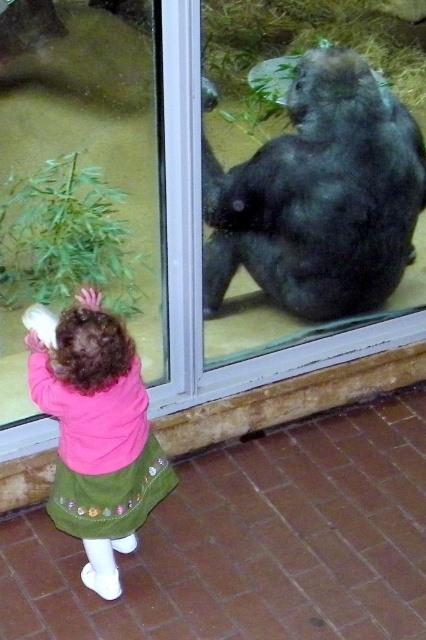
Question: Can you confirm if dark gray fur at center is positioned above pink fleece jacket at lower left?

Choices:
 (A) no
 (B) yes

Answer: (B)

Question: Considering the relative positions of pink fleece jacket at lower left and transparent glass door at upper center in the image provided, where is pink fleece jacket at lower left located with respect to transparent glass door at upper center?

Choices:
 (A) right
 (B) left

Answer: (B)

Question: Which point is closer to the camera taking this photo?

Choices:
 (A) (103, 440)
 (B) (400, 250)

Answer: (A)

Question: Which is farther from the transparent glass door at upper center?

Choices:
 (A) dark gray fur at center
 (B) pink fleece jacket at lower left

Answer: (B)

Question: Which object is closer to the camera taking this photo?

Choices:
 (A) pink fleece jacket at lower left
 (B) dark gray fur at center

Answer: (A)

Question: Can you confirm if dark gray fur at center is bigger than pink fleece jacket at lower left?

Choices:
 (A) yes
 (B) no

Answer: (A)